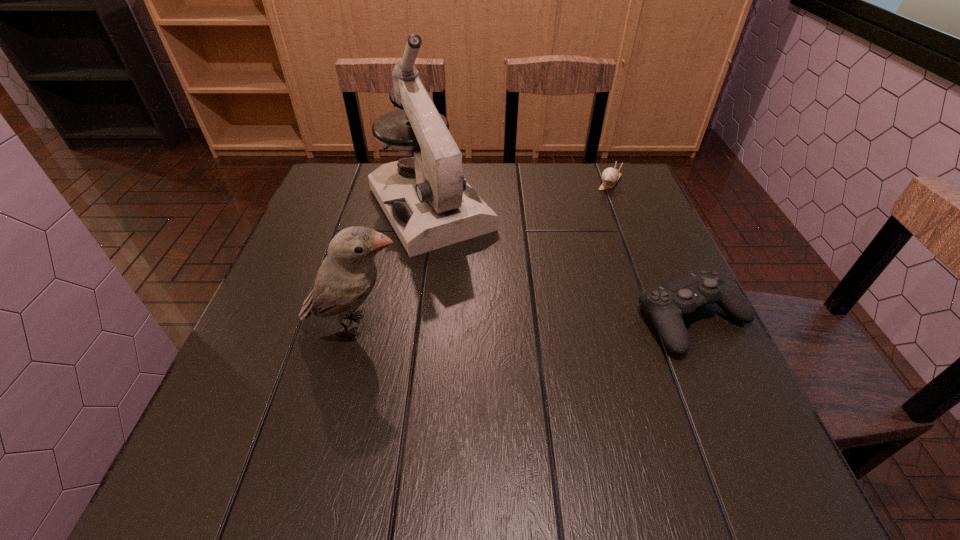
Locate an element on the screen. vacant spot on the desktop that is between the third shortest object and the control and is positioned at the eyepiece of the microscope is located at coordinates (512, 322).

Image resolution: width=960 pixels, height=540 pixels. I want to click on free space on the desktop that is between the third shortest object and the third tallest object and is positioned on the shell of the escargot, so click(516, 322).